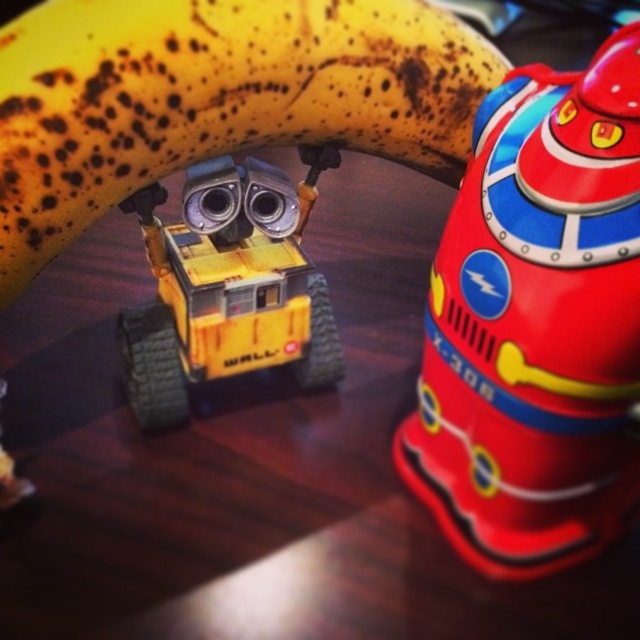
Question: Which point is closer to the camera taking this photo?

Choices:
 (A) (563, 241)
 (B) (74, 173)
 (C) (195, 323)

Answer: (A)

Question: Does shiny plastic toy at upper right come in front of yellow spotted banana at upper center?

Choices:
 (A) no
 (B) yes

Answer: (B)

Question: Can you confirm if yellow spotted banana at upper center is wider than yellow matte robot at center?

Choices:
 (A) yes
 (B) no

Answer: (A)

Question: Where is shiny plastic toy at upper right located in relation to yellow matte robot at center in the image?

Choices:
 (A) below
 (B) above

Answer: (A)

Question: Which object is positioned closest to the shiny plastic toy at upper right?

Choices:
 (A) yellow matte robot at center
 (B) yellow spotted banana at upper center

Answer: (B)

Question: Considering the real-world distances, which object is farthest from the yellow spotted banana at upper center?

Choices:
 (A) shiny plastic toy at upper right
 (B) yellow matte robot at center

Answer: (A)